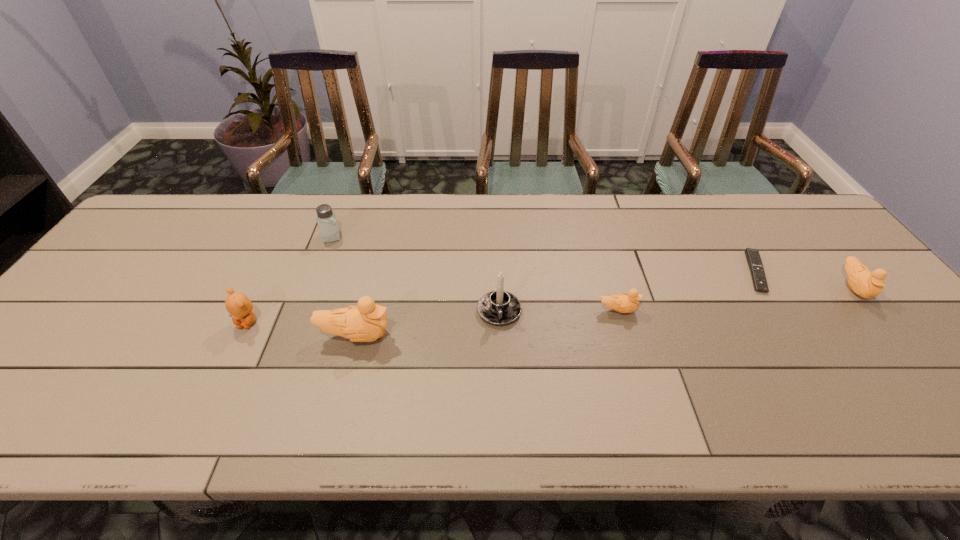
Please point a free position for a duckling on the left. Please provide its 2D coordinates. Your answer should be formatted as a tuple, i.e. [(x, y)], where the tuple contains the x and y coordinates of a point satisfying the conditions above.

[(64, 364)]